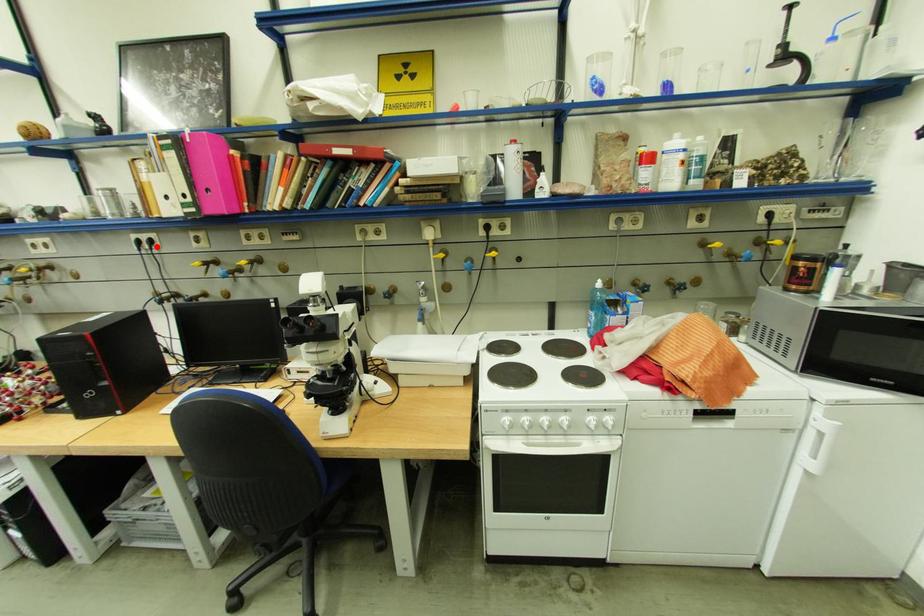
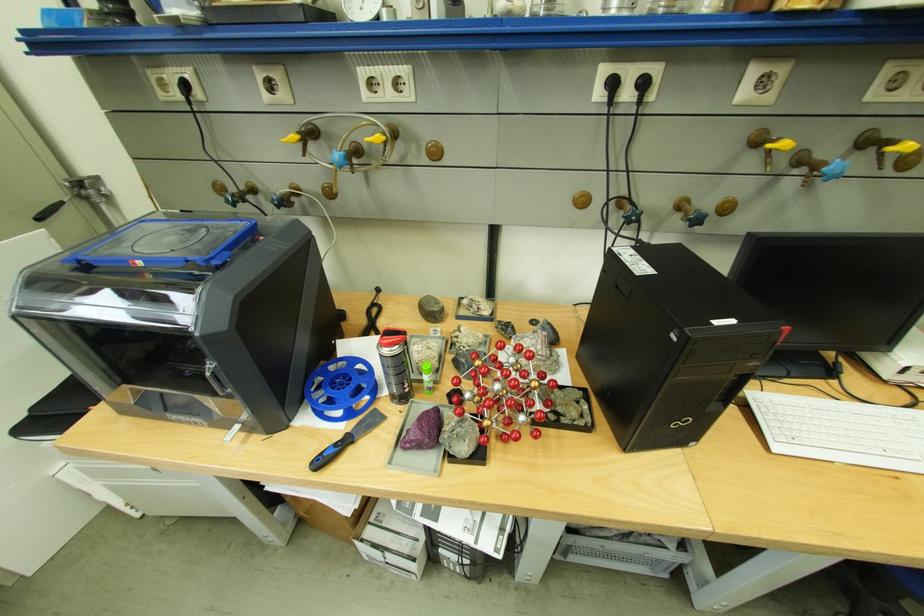
Locate, in the second image, the point that corresponds to the highlighted location in the first image.

(638, 95)